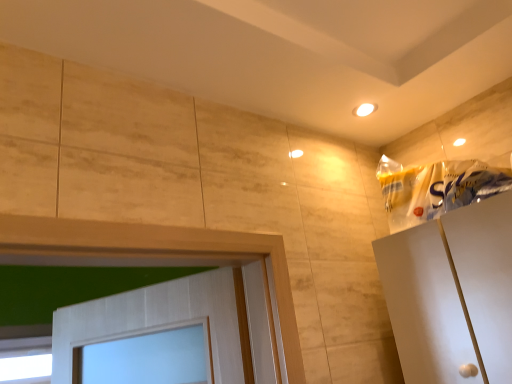
Question: Is transparent glass window at lower left at the back of translucent plastic bag at upper right?

Choices:
 (A) yes
 (B) no

Answer: (B)

Question: Can you confirm if translucent plastic bag at upper right is shorter than transparent glass window at lower left?

Choices:
 (A) yes
 (B) no

Answer: (A)

Question: Can you confirm if translucent plastic bag at upper right is smaller than transparent glass window at lower left?

Choices:
 (A) no
 (B) yes

Answer: (A)

Question: Is translucent plastic bag at upper right far from transparent glass window at lower left?

Choices:
 (A) yes
 (B) no

Answer: (A)

Question: Is translucent plastic bag at upper right facing towards transparent glass window at lower left?

Choices:
 (A) no
 (B) yes

Answer: (A)

Question: Considering the relative positions of translucent plastic bag at upper right and transparent glass window at lower left in the image provided, is translucent plastic bag at upper right in front of transparent glass window at lower left?

Choices:
 (A) yes
 (B) no

Answer: (A)

Question: Considering the relative sizes of transparent glass window at lower left and translucent plastic bag at upper right in the image provided, is transparent glass window at lower left bigger than translucent plastic bag at upper right?

Choices:
 (A) yes
 (B) no

Answer: (B)

Question: Is transparent glass window at lower left smaller than translucent plastic bag at upper right?

Choices:
 (A) no
 (B) yes

Answer: (B)

Question: Considering the relative sizes of transparent glass window at lower left and translucent plastic bag at upper right in the image provided, is transparent glass window at lower left wider than translucent plastic bag at upper right?

Choices:
 (A) no
 (B) yes

Answer: (A)

Question: From the image's perspective, is transparent glass window at lower left located beneath translucent plastic bag at upper right?

Choices:
 (A) no
 (B) yes

Answer: (B)

Question: Is transparent glass window at lower left to the right of translucent plastic bag at upper right from the viewer's perspective?

Choices:
 (A) no
 (B) yes

Answer: (A)

Question: From a real-world perspective, does transparent glass window at lower left sit lower than translucent plastic bag at upper right?

Choices:
 (A) yes
 (B) no

Answer: (A)

Question: From a real-world perspective, is transparent glass window at lower left physically located above or below translucent plastic bag at upper right?

Choices:
 (A) below
 (B) above

Answer: (A)